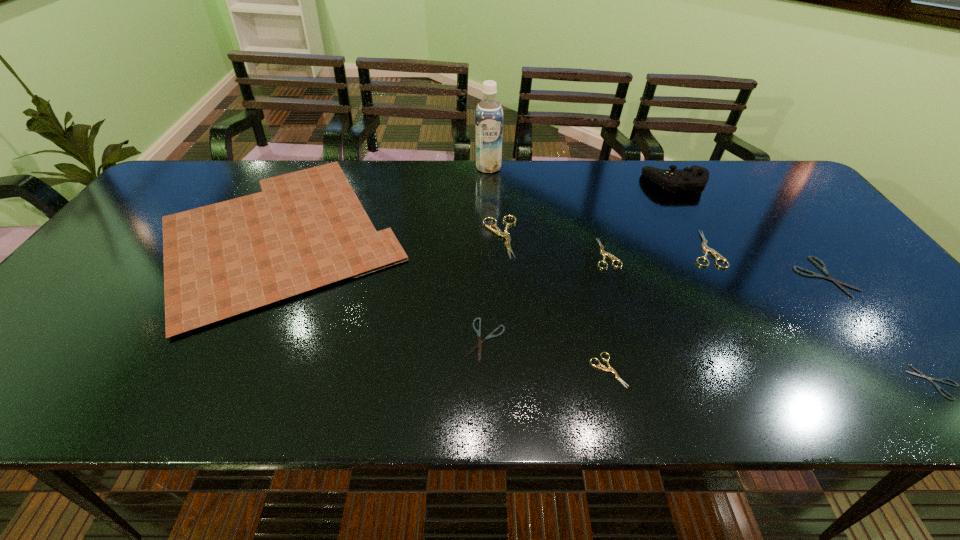
I want to click on the closest black shears to the control, so (823, 268).

I want to click on black shears that can be found as the closest to the leftmost black shears, so click(x=823, y=268).

I want to click on free spot that satisfies the following two spatial constraints: 1. on the label of the tallest object; 2. on the right side of the biggest black shears, so click(492, 277).

Where is `free point that satisfies the following two spatial constraints: 1. on the back side of the fifth tallest object; 2. on the left side of the second tallest object`? This screenshot has height=540, width=960. free point that satisfies the following two spatial constraints: 1. on the back side of the fifth tallest object; 2. on the left side of the second tallest object is located at coordinates (668, 183).

Where is `free space that satisfies the following two spatial constraints: 1. on the back side of the biggest black shears; 2. on the right side of the second farthest black shears`? This screenshot has width=960, height=540. free space that satisfies the following two spatial constraints: 1. on the back side of the biggest black shears; 2. on the right side of the second farthest black shears is located at coordinates (485, 277).